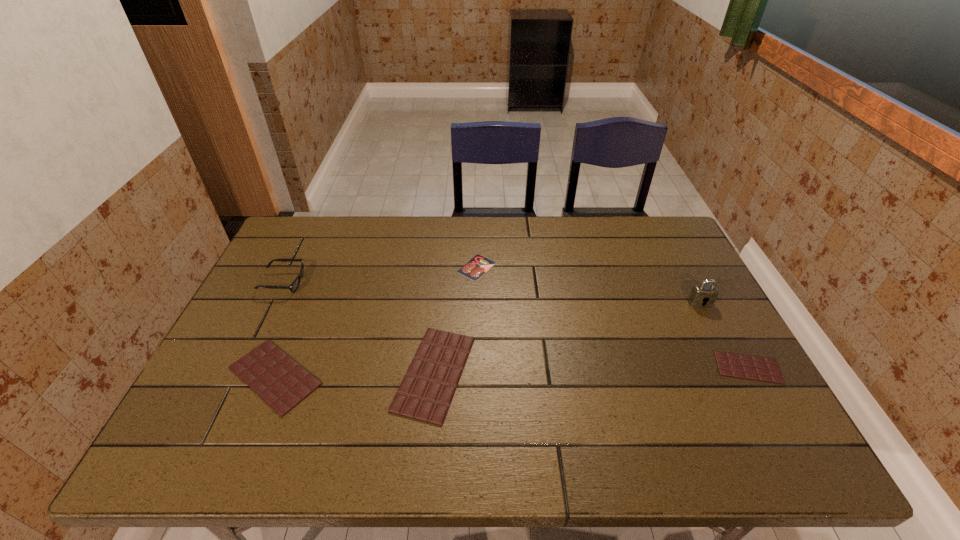
Please point a location where one more chocolate_bar can be added evenly. Please provide its 2D coordinates. Your answer should be formatted as a tuple, i.e. [(x, y)], where the tuple contains the x and y coordinates of a point satisfying the conditions above.

[(592, 370)]